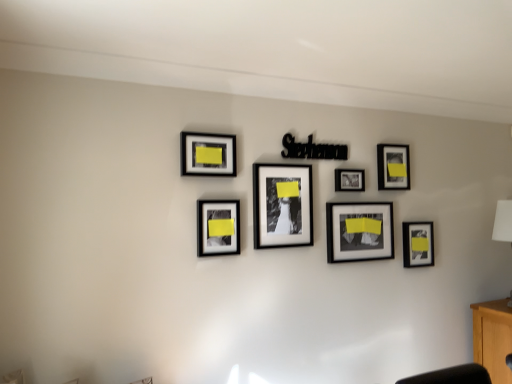
Question: Is beech wood cabinet at lower right inside the boundaries of black matte picture frame at center, marked as the 4th picture frame in a left-to-right arrangement, or outside?

Choices:
 (A) outside
 (B) inside

Answer: (A)

Question: Visually, is beech wood cabinet at lower right positioned to the left or to the right of black matte picture frame at center, marked as the 4th picture frame in a left-to-right arrangement?

Choices:
 (A) right
 (B) left

Answer: (A)

Question: Estimate the real-world distances between objects in this image. Which object is farther from the matte black picture frame at center-left, arranged as the 6th picture frame when viewed from the right?

Choices:
 (A) matte black frame at upper left, arranged as the 1th picture frame when viewed from the left
 (B) black matte picture frame at center, marked as the 4th picture frame in a left-to-right arrangement
 (C) matte black picture frame at upper right, positioned as the sixth picture frame in left-to-right order
 (D) white fabric lampshade at right
 (E) matte black photo frame at center, the 3th picture frame from the left

Answer: (D)

Question: Which is farther from the black matte picture frame at center, marked as the 4th picture frame in a left-to-right arrangement?

Choices:
 (A) matte black photo frame at center, the 3th picture frame from the left
 (B) matte black frame at lower right, which appears as the seventh picture frame when viewed from the left
 (C) white fabric lampshade at right
 (D) matte black picture frame at upper right, positioned as the sixth picture frame in left-to-right order
 (E) beech wood cabinet at lower right

Answer: (E)